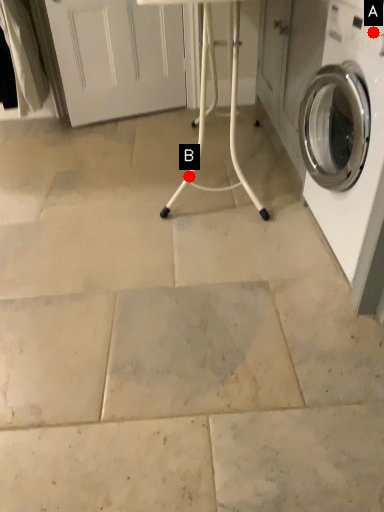
Question: Two points are circled on the image, labeled by A and B beside each circle. Which point is farther from the camera taking this photo?

Choices:
 (A) A is further
 (B) B is further

Answer: (B)